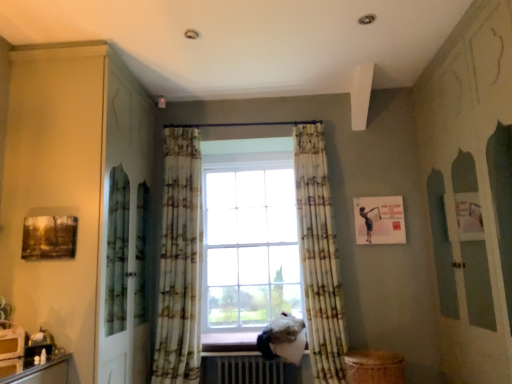
Question: From a real-world perspective, is metallic silver radiator at lower center positioned over wooden at lower center based on gravity?

Choices:
 (A) yes
 (B) no

Answer: (B)

Question: From the image's perspective, is metallic silver radiator at lower center located above wooden at lower center?

Choices:
 (A) yes
 (B) no

Answer: (B)

Question: Does metallic silver radiator at lower center have a lesser height compared to wooden at lower center?

Choices:
 (A) no
 (B) yes

Answer: (A)

Question: Considering the relative sizes of metallic silver radiator at lower center and wooden at lower center in the image provided, is metallic silver radiator at lower center wider than wooden at lower center?

Choices:
 (A) no
 (B) yes

Answer: (B)

Question: Would you say metallic silver radiator at lower center is a long distance from wooden at lower center?

Choices:
 (A) yes
 (B) no

Answer: (B)

Question: Is metallic silver radiator at lower center positioned before wooden at lower center?

Choices:
 (A) no
 (B) yes

Answer: (B)

Question: Can we say floral fabric curtain at center, the first curtain from the right, lies outside wooden at lower center?

Choices:
 (A) yes
 (B) no

Answer: (A)

Question: Is floral fabric curtain at center, the first curtain from the right, wider than wooden at lower center?

Choices:
 (A) no
 (B) yes

Answer: (A)

Question: Are floral fabric curtain at center, arranged as the second curtain when viewed from the left, and wooden at lower center beside each other?

Choices:
 (A) no
 (B) yes

Answer: (A)

Question: Is floral fabric curtain at center, the first curtain from the right, at the left side of wooden at lower center?

Choices:
 (A) yes
 (B) no

Answer: (B)

Question: Is floral fabric curtain at center, the first curtain from the right, far away from wooden at lower center?

Choices:
 (A) no
 (B) yes

Answer: (B)

Question: Could you tell me if floral fabric curtain at center, arranged as the second curtain when viewed from the left, is turned towards wooden at lower center?

Choices:
 (A) yes
 (B) no

Answer: (B)

Question: Considering the relative sizes of metallic silver radiator at lower center and floral fabric curtain at center, the first curtain from the right, in the image provided, is metallic silver radiator at lower center shorter than floral fabric curtain at center, the first curtain from the right,?

Choices:
 (A) no
 (B) yes

Answer: (B)